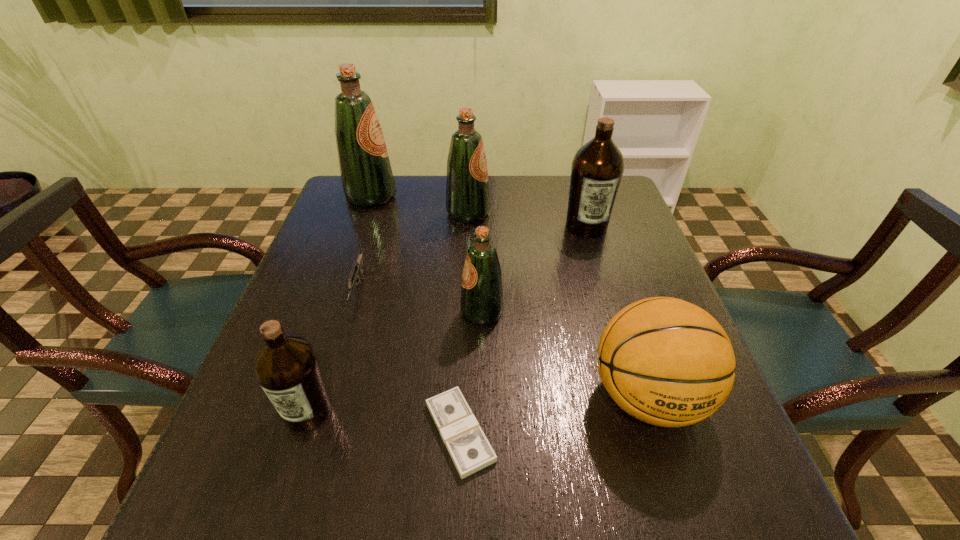
Find the location of a particular element. The height and width of the screenshot is (540, 960). free space located 0.080m aimed along the barrel of the seventh tallest object is located at coordinates (341, 342).

In order to click on vacant space located on the right of the shortest object in this screenshot , I will do `click(676, 432)`.

Locate an element on the screen. Image resolution: width=960 pixels, height=540 pixels. object that is at the near edge is located at coordinates (470, 450).

This screenshot has height=540, width=960. What are the coordinates of `gun present at the left edge` in the screenshot? It's located at (357, 267).

Where is `olive oil located in the right edge section of the desktop`? olive oil located in the right edge section of the desktop is located at coordinates (597, 168).

At what (x,y) coordinates should I click in order to perform the action: click on basketball at the right edge. Please return your answer as a coordinate pair (x, y). The height and width of the screenshot is (540, 960). Looking at the image, I should click on (667, 362).

Locate an element on the screen. object that is at the far left corner is located at coordinates (366, 175).

Locate an element on the screen. The height and width of the screenshot is (540, 960). object at the far right corner is located at coordinates (597, 168).

Locate an element on the screen. The width and height of the screenshot is (960, 540). vacant space at the far edge of the desktop is located at coordinates (428, 184).

Where is `vacant space at the near edge of the desktop`? This screenshot has width=960, height=540. vacant space at the near edge of the desktop is located at coordinates pyautogui.click(x=348, y=495).